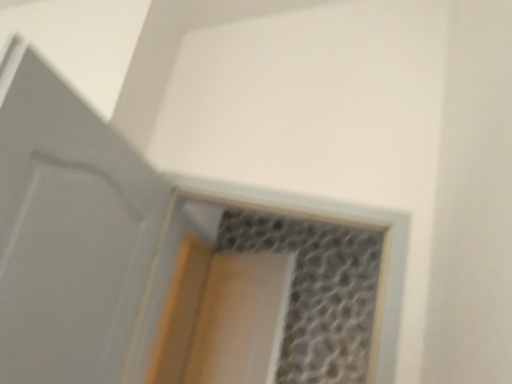
In order to face white matte door at left, should I rotate leftwards or rightwards?

A 23.380 degree turn to the left will do.

Describe the element at coordinates (241, 319) in the screenshot. I see `clear plastic screen door at center` at that location.

The width and height of the screenshot is (512, 384). I want to click on white matte door at left, so click(x=67, y=230).

How many degrees apart are the facing directions of clear plastic screen door at center and translucent glass window at center?

45.1 degrees.

From a real-world perspective, is clear plastic screen door at center physically located above or below translucent glass window at center?

Clearly, from a real-world perspective, clear plastic screen door at center is below translucent glass window at center.

From the image's perspective, which one is positioned lower, clear plastic screen door at center or translucent glass window at center?

From the image's view, clear plastic screen door at center is below.

Is translucent glass window at center a part of clear plastic screen door at center?

No, translucent glass window at center is not a part of clear plastic screen door at center.

Which object is positioned more to the right, white matte door at left or clear plastic screen door at center?

From the viewer's perspective, clear plastic screen door at center appears more on the right side.

Is white matte door at left further to camera compared to clear plastic screen door at center?

No, the depth of white matte door at left is less than that of clear plastic screen door at center.

Is white matte door at left oriented away from clear plastic screen door at center?

No, clear plastic screen door at center is not at the back of white matte door at left.

How different are the orientations of white matte door at left and clear plastic screen door at center in degrees?

There is a 126-degree angle between the facing directions of white matte door at left and clear plastic screen door at center.

Looking at their sizes, would you say translucent glass window at center is wider or thinner than white matte door at left?

translucent glass window at center is wider than white matte door at left.

Do you think translucent glass window at center is within white matte door at left, or outside of it?

translucent glass window at center is spatially situated outside white matte door at left.

Which is more to the right, translucent glass window at center or white matte door at left?

Positioned to the right is translucent glass window at center.

Is translucent glass window at center oriented towards white matte door at left?

Yes.

Measure the distance between clear plastic screen door at center and white matte door at left.

The distance of clear plastic screen door at center from white matte door at left is 1.43 meters.

Is white matte door at left inside clear plastic screen door at center?

That's incorrect, white matte door at left is not inside clear plastic screen door at center.

How different are the orientations of clear plastic screen door at center and white matte door at left in degrees?

The angular difference between clear plastic screen door at center and white matte door at left is 126 degrees.

Is point (219, 354) less distant than point (92, 124)?

No, it is not.

Would you say translucent glass window at center is outside clear plastic screen door at center?

That's correct, translucent glass window at center is outside of clear plastic screen door at center.

From a real-world perspective, is translucent glass window at center above or below clear plastic screen door at center?

translucent glass window at center is situated higher than clear plastic screen door at center in the real world.

Which point is more forward, (341, 242) or (234, 363)?

Positioned in front is point (234, 363).

From the image's perspective, relative to clear plastic screen door at center, is translucent glass window at center above or below?

From the image's perspective, translucent glass window at center appears above clear plastic screen door at center.

Is white matte door at left situated inside translucent glass window at center or outside?

white matte door at left is located beyond the bounds of translucent glass window at center.

Is white matte door at left oriented away from translucent glass window at center?

No.

Can you confirm if white matte door at left is positioned to the right of translucent glass window at center?

In fact, white matte door at left is to the left of translucent glass window at center.

Is white matte door at left thinner than translucent glass window at center?

Correct, the width of white matte door at left is less than that of translucent glass window at center.

Identify the location of screen door below the translucent glass window at center (from the image's perspective). The width and height of the screenshot is (512, 384). (241, 319).

Find the location of a particular element. This screenshot has height=384, width=512. door in front of the clear plastic screen door at center is located at coordinates (x=67, y=230).

Which object lies nearer to the anchor point translucent glass window at center, clear plastic screen door at center or white matte door at left?

clear plastic screen door at center.

From the image, which object appears to be farther from clear plastic screen door at center, translucent glass window at center or white matte door at left?

white matte door at left is further to clear plastic screen door at center.

Considering their positions, is translucent glass window at center positioned further to white matte door at left than clear plastic screen door at center?

The object further to white matte door at left is clear plastic screen door at center.

Based on their spatial positions, is clear plastic screen door at center or translucent glass window at center further from white matte door at left?

clear plastic screen door at center lies further to white matte door at left than the other object.

Estimate the real-world distances between objects in this image. Which object is closer to clear plastic screen door at center, white matte door at left or translucent glass window at center?

The object closer to clear plastic screen door at center is translucent glass window at center.

From the image, which object appears to be farther from translucent glass window at center, white matte door at left or clear plastic screen door at center?

white matte door at left is positioned further to the anchor translucent glass window at center.

The width and height of the screenshot is (512, 384). I want to click on window located between white matte door at left and clear plastic screen door at center in the depth direction, so click(x=272, y=291).